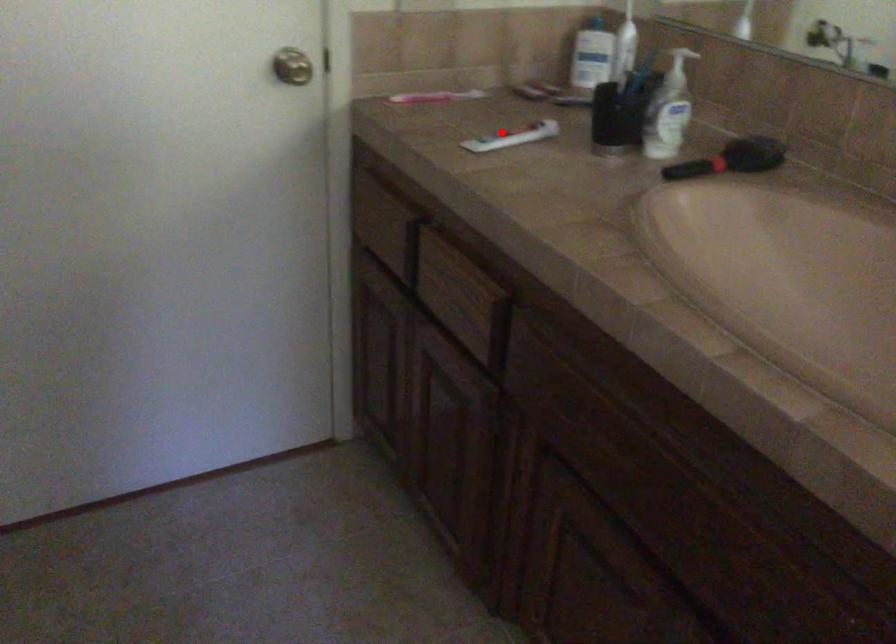
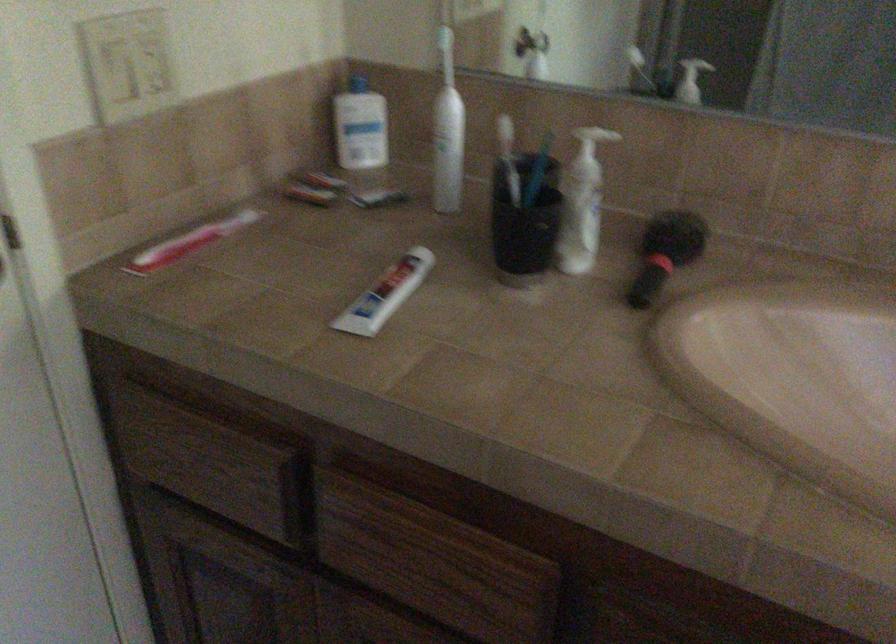
Question: I am providing you with two images of the same scene from different viewpoints. Given a red point in image1, look at the same physical point in image2. Is it:

Choices:
 (A) Closer to the viewpoint
 (B) Farther from the viewpoint

Answer: (A)